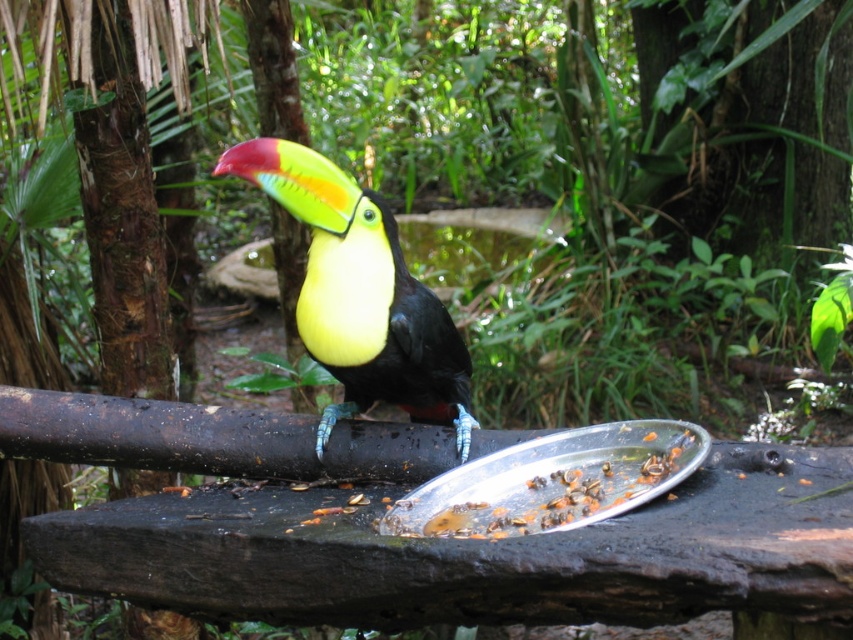
Question: Is shiny multicolored toucan at center wider than metallic silver tray at center?

Choices:
 (A) yes
 (B) no

Answer: (B)

Question: Which of the following is the farthest from the observer?

Choices:
 (A) metallic silver tray at center
 (B) shiny multicolored toucan at center

Answer: (B)

Question: Is the position of shiny multicolored toucan at center less distant than that of metallic silver tray at center?

Choices:
 (A) no
 (B) yes

Answer: (A)

Question: Which of the following is the closest to the observer?

Choices:
 (A) shiny multicolored toucan at center
 (B) metallic silver tray at center

Answer: (B)

Question: Considering the relative positions of shiny multicolored toucan at center and metallic silver tray at center in the image provided, where is shiny multicolored toucan at center located with respect to metallic silver tray at center?

Choices:
 (A) below
 (B) above

Answer: (B)